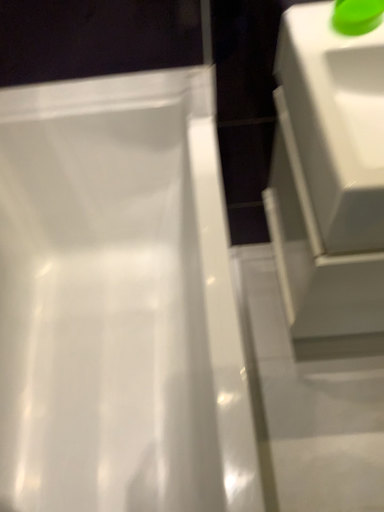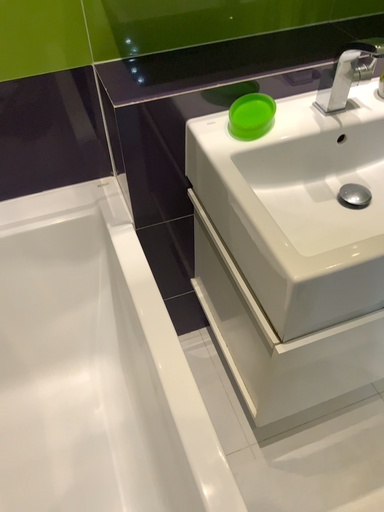
Question: Which way did the camera rotate in the video?

Choices:
 (A) rotated downward
 (B) rotated upward

Answer: (B)